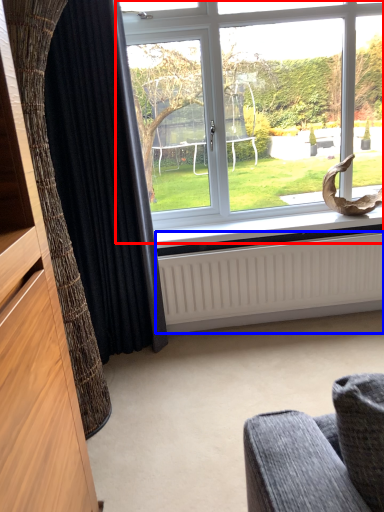
Question: Among these objects, which one is farthest to the camera, window (highlighted by a red box) or radiator (highlighted by a blue box)?

Choices:
 (A) window
 (B) radiator

Answer: (B)